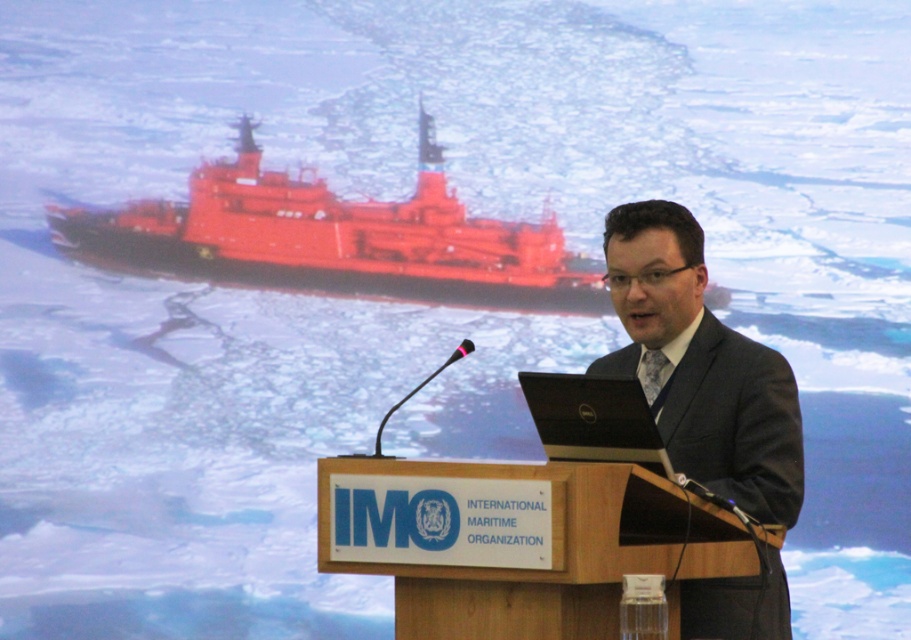
You are an attendee at the presentation and need to locate the wooden podium at center and the metallic red ship at center. From your perspective, which object is positioned to the left?

The metallic red ship at center is positioned to the left of the wooden podium at center.